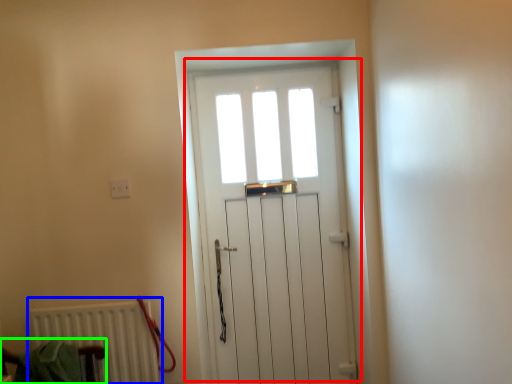
Question: Estimate the real-world distances between objects in this image. Which object is farther from door (highlighted by a red box), radiator (highlighted by a blue box) or armchair (highlighted by a green box)?

Choices:
 (A) radiator
 (B) armchair

Answer: (B)